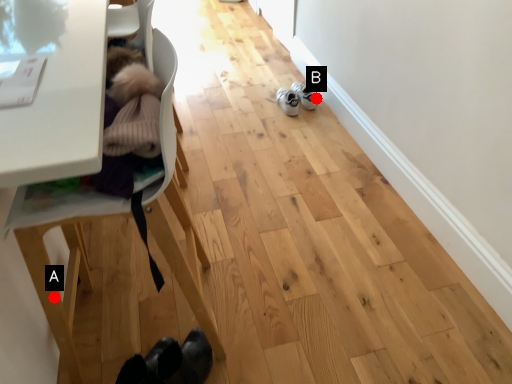
Question: Two points are circled on the image, labeled by A and B beside each circle. Among these points, which one is nearest to the camera?

Choices:
 (A) A is closer
 (B) B is closer

Answer: (A)